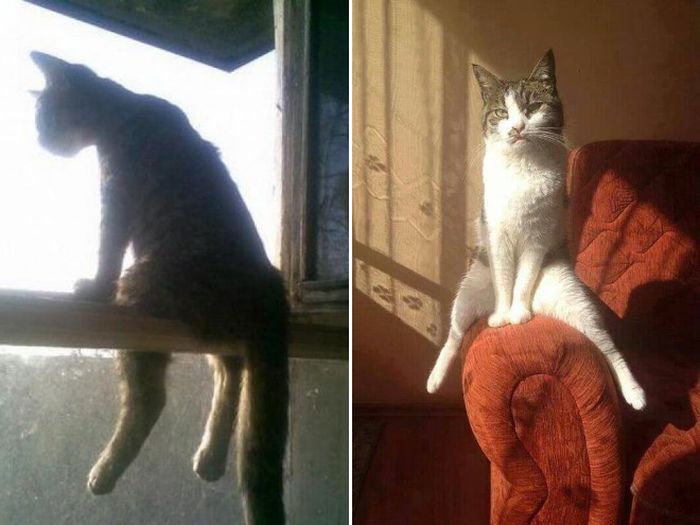
The width and height of the screenshot is (700, 525). I want to click on window border, so click(x=292, y=135), click(x=301, y=331), click(x=68, y=339), click(x=320, y=300).